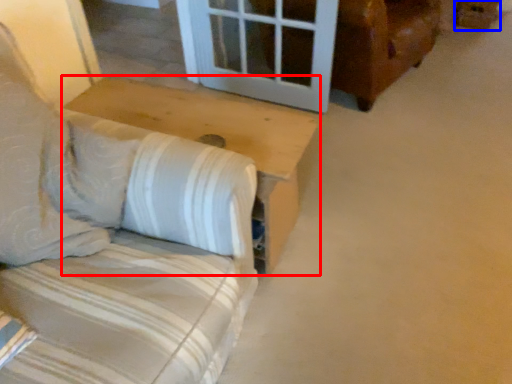
Question: Which of the following is the farthest to the observer, table (highlighted by a red box) or cardboard box (highlighted by a blue box)?

Choices:
 (A) table
 (B) cardboard box

Answer: (B)